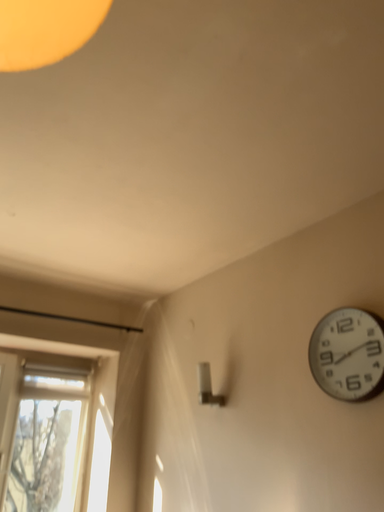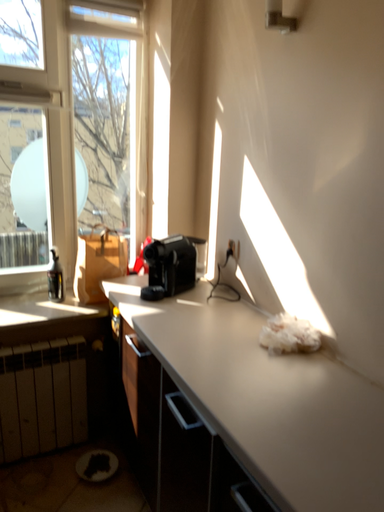
Question: How did the camera likely rotate when shooting the video?

Choices:
 (A) rotated downward
 (B) rotated upward

Answer: (A)